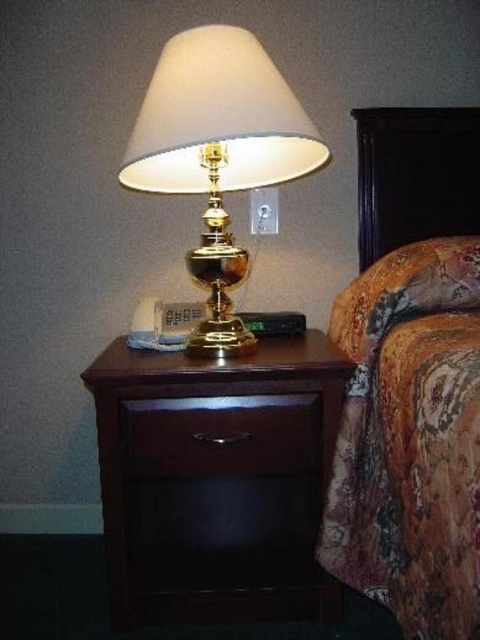
You are organizing the items on the nightstand and need to know the relative positions of the floral fabric bed at right and the gold polished table lamp at upper center. Which one is positioned to the right of the other?

The floral fabric bed at right is to the right of the gold polished table lamp at upper center.

You are standing in the room and want to reach the gold polished table lamp at upper center first before going to the floral fabric bed at right. Which object should you approach first based on their positions?

You should approach the gold polished table lamp at upper center first since it is farther from the viewer compared to the floral fabric bed at right, allowing you to pass by it on your way to the bed.